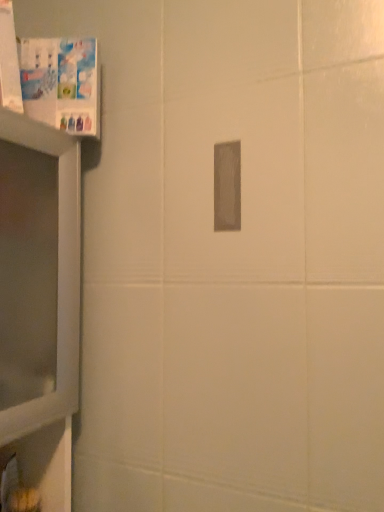
Image resolution: width=384 pixels, height=512 pixels. Describe the element at coordinates (61, 83) in the screenshot. I see `white cardboard cabinet at upper left` at that location.

Measure the distance between point (65, 85) and camera.

Point (65, 85) and camera are 30.51 inches apart.

In order to click on white cardboard cabinet at upper left in this screenshot , I will do `click(61, 83)`.

Measure the distance between white cardboard cabinet at upper left and camera.

white cardboard cabinet at upper left is 29.72 inches away from camera.

Identify the location of white cardboard cabinet at upper left. (61, 83).